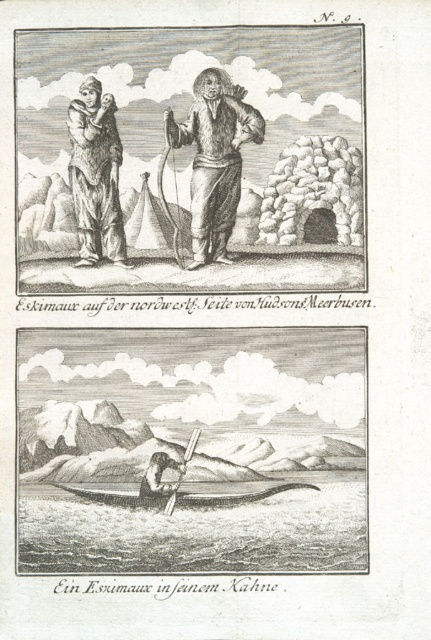
Measure the distance from brown fur coat at center to wooden canoe at center.

brown fur coat at center and wooden canoe at center are 3.88 meters apart.

Which is behind, point (241, 108) or point (296, 488)?

Point (241, 108)

Between point (227, 216) and point (131, 497), which one is positioned in front?

Point (131, 497)

You are a GUI agent. You are given a task and a screenshot of the screen. Output one action in this format:
    pyautogui.click(x=<x>, y=<y>)
    Task: Click on the brown fur coat at center
    
    Given the screenshot: What is the action you would take?
    pyautogui.click(x=215, y=160)

Locate an element on the screen. brown fur coat at center is located at coordinates (215, 160).

Is brown fur coat at center to the left of smooth skin person at lower center from the viewer's perspective?

Incorrect, brown fur coat at center is not on the left side of smooth skin person at lower center.

Describe the element at coordinates (215, 160) in the screenshot. I see `brown fur coat at center` at that location.

The height and width of the screenshot is (640, 431). In order to click on brown fur coat at center in this screenshot , I will do `click(215, 160)`.

Who is more distant from viewer, (153, 250) or (74, 492)?

Positioned behind is point (153, 250).

Describe the element at coordinates (190, 160) in the screenshot. I see `black fur coat at upper center` at that location.

Is point (62, 157) farther from camera compared to point (215, 496)?

Yes.

Locate an element on the screen. The height and width of the screenshot is (640, 431). black fur coat at upper center is located at coordinates (190, 160).